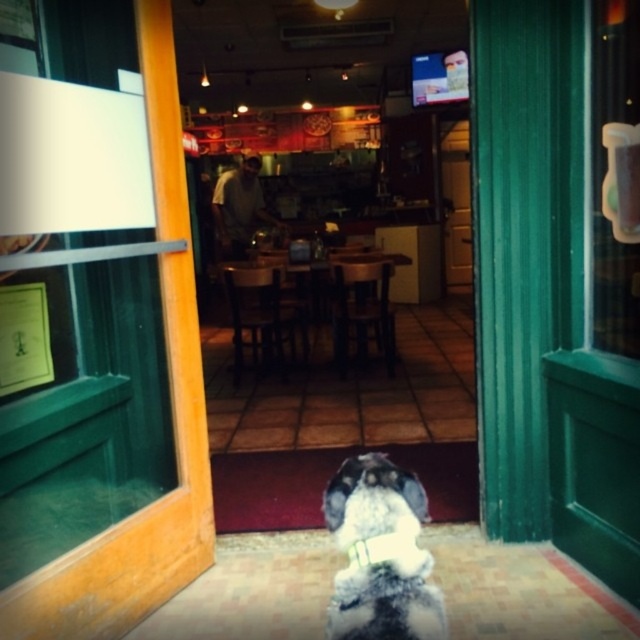
In the scene shown: You are a delivery person holding a package that requires a 36 inch clearance to maneuver. You are standing outside the establishment and see the white fluffy dog at center blocking the entrance. Can you pass through the entrance without bending or moving the dog?

The white fluffy dog at center is 37.17 inches from camera. Since the required clearance is 36 inches and the dog is 37.17 inches away, you can pass through the entrance without bending or moving the dog because the distance is sufficient.

Looking at this image, you are a customer standing outside the establishment and want to enter. You see the green wooden door at center and the white fabric neckband at center. Which object is closer to the ground?

The white fabric neckband at center is closer to the ground because the green wooden door at center is located above it.